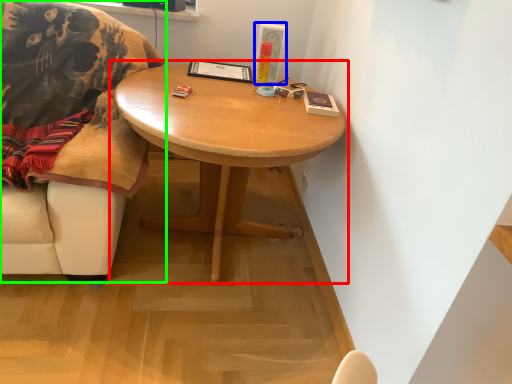
Question: Which object is the farthest from coffee table (highlighted by a red box)? Choose among these: picture frame (highlighted by a blue box) or chair (highlighted by a green box).

Choices:
 (A) picture frame
 (B) chair

Answer: (A)